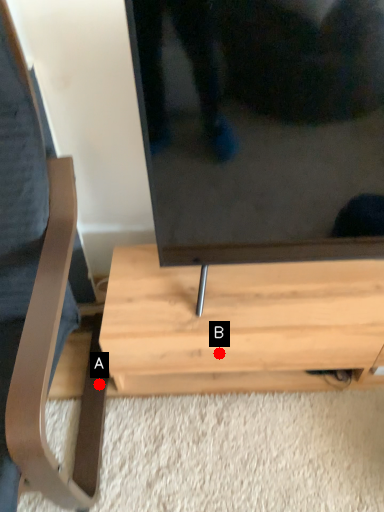
Question: Two points are circled on the image, labeled by A and B beside each circle. Which point is closer to the camera taking this photo?

Choices:
 (A) A is closer
 (B) B is closer

Answer: (B)